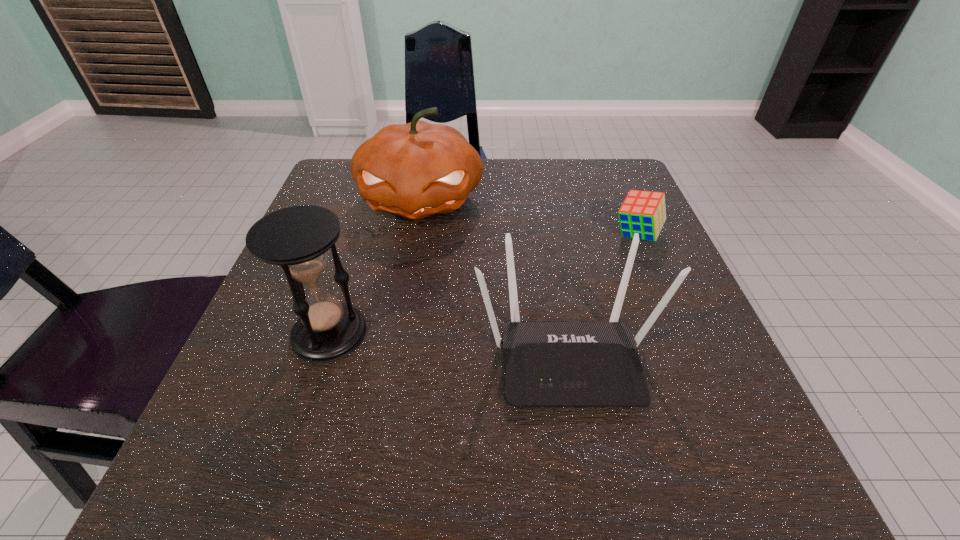
Where is `hourglass present at the left edge`? This screenshot has height=540, width=960. hourglass present at the left edge is located at coordinates coord(297,238).

Locate an element on the screen. router located at the right edge is located at coordinates (546, 364).

The image size is (960, 540). In order to click on cube positioned at the right edge in this screenshot , I will do `click(643, 212)`.

Find the location of a particular element. object present at the far left corner is located at coordinates (415, 170).

The width and height of the screenshot is (960, 540). Find the location of `vacant space at the far edge of the desktop`. vacant space at the far edge of the desktop is located at coordinates tap(534, 188).

The image size is (960, 540). What are the coordinates of `vacant region at the near edge of the desktop` in the screenshot? It's located at (572, 478).

Where is `free point at the left edge`? This screenshot has height=540, width=960. free point at the left edge is located at coordinates click(x=371, y=232).

At what (x,y) coordinates should I click in order to perform the action: click on free spot at the right edge of the desktop. Please return your answer as a coordinate pair (x, y). This screenshot has width=960, height=540. Looking at the image, I should click on (719, 405).

Find the location of a particular element. This screenshot has height=540, width=960. free space at the far left corner is located at coordinates (347, 199).

I want to click on free location at the far right corner, so click(618, 178).